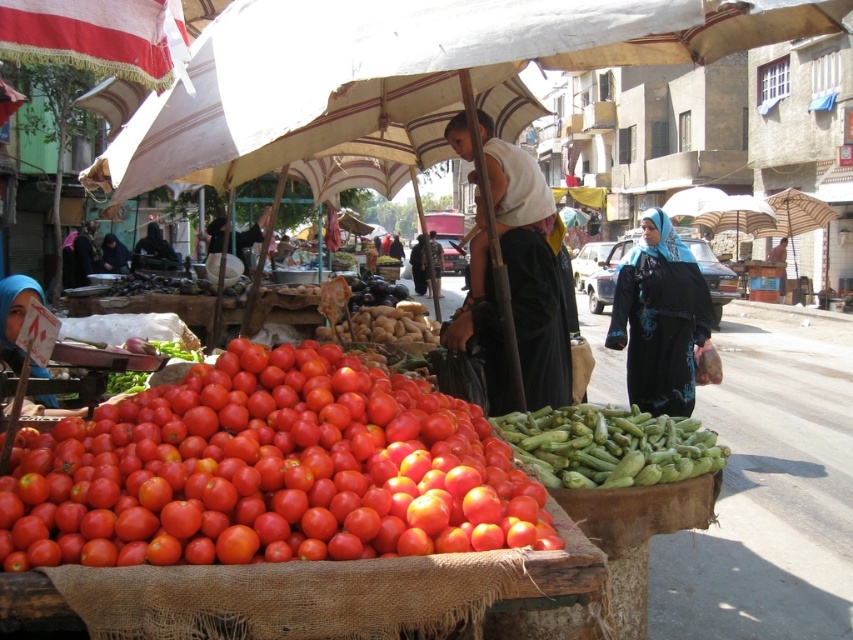
Question: Which is nearer to the black fabric headscarf at right?

Choices:
 (A) green matte okra at lower center
 (B) shiny red tomatoes at lower left
 (C) matte blue hijab at lower left
 (D) smooth brown potatoes at center

Answer: (D)

Question: Which object is farther from the camera taking this photo?

Choices:
 (A) black fabric headscarf at right
 (B) green matte okra at lower center

Answer: (A)

Question: Observing the image, what is the correct spatial positioning of black fabric headscarf at right in reference to green matte okra at lower center?

Choices:
 (A) above
 (B) below

Answer: (A)

Question: Does black fabric headscarf at right have a lesser width compared to matte blue hijab at lower left?

Choices:
 (A) yes
 (B) no

Answer: (A)

Question: Which point is farther to the camera?

Choices:
 (A) (27, 296)
 (B) (544, 420)
 (C) (387, 292)
 (D) (115, 432)

Answer: (C)

Question: Does shiny red tomatoes at lower left appear under matte blue hijab at lower left?

Choices:
 (A) yes
 (B) no

Answer: (A)